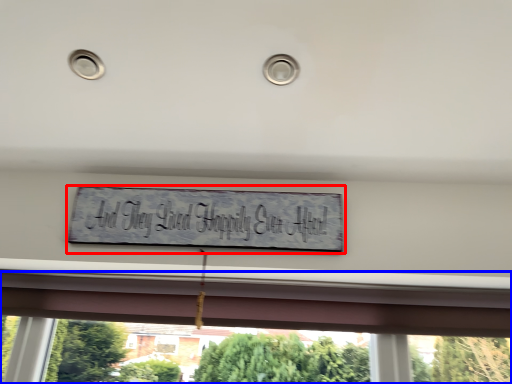
Question: Which object is closer to the camera taking this photo, sign (highlighted by a red box) or window (highlighted by a blue box)?

Choices:
 (A) sign
 (B) window

Answer: (A)